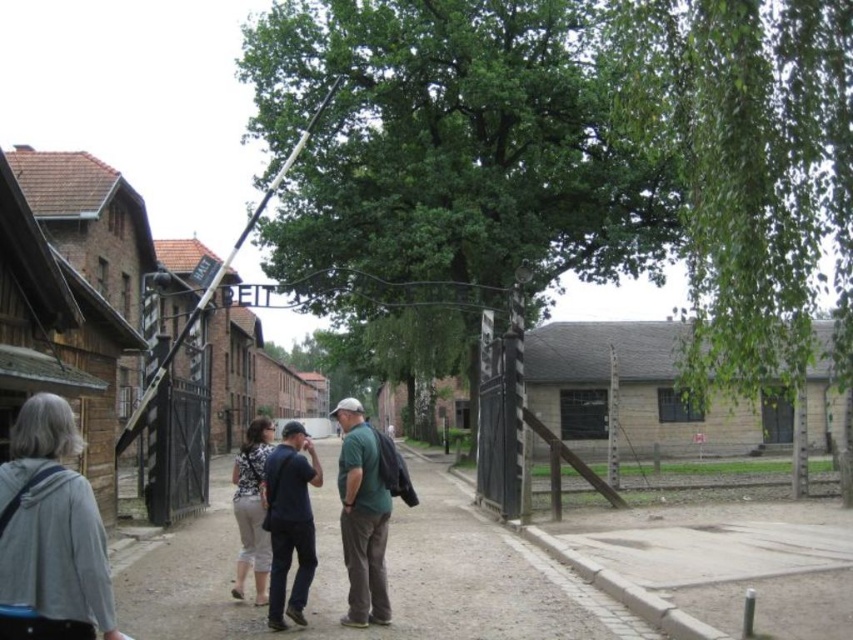
Is green matte shirt at center bigger than printed fabric pants at center?

No.

Is point (347, 476) in front of point (260, 589)?

That is True.

Identify the location of green matte shirt at center. click(x=363, y=516).

Can you confirm if gray fabric jacket at lower left is bigger than green matte shirt at center?

No.

Is gray fabric jacket at lower left positioned before green matte shirt at center?

Yes.

Who is more distant from viewer, (16, 464) or (357, 612)?

Point (357, 612)

Locate an element on the screen. gray fabric jacket at lower left is located at coordinates [51, 532].

Where is `dark blue jeans at center`? This screenshot has height=640, width=853. dark blue jeans at center is located at coordinates (289, 522).

Which is behind, point (276, 616) or point (233, 464)?

The point (233, 464) is behind.

Locate an element on the screen. The image size is (853, 640). dark blue jeans at center is located at coordinates (289, 522).